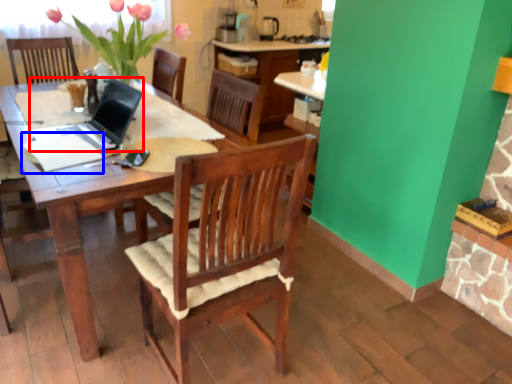
Question: Which point is further to the camera, laptop (highlighted by a red box) or notepad (highlighted by a blue box)?

Choices:
 (A) laptop
 (B) notepad

Answer: (B)